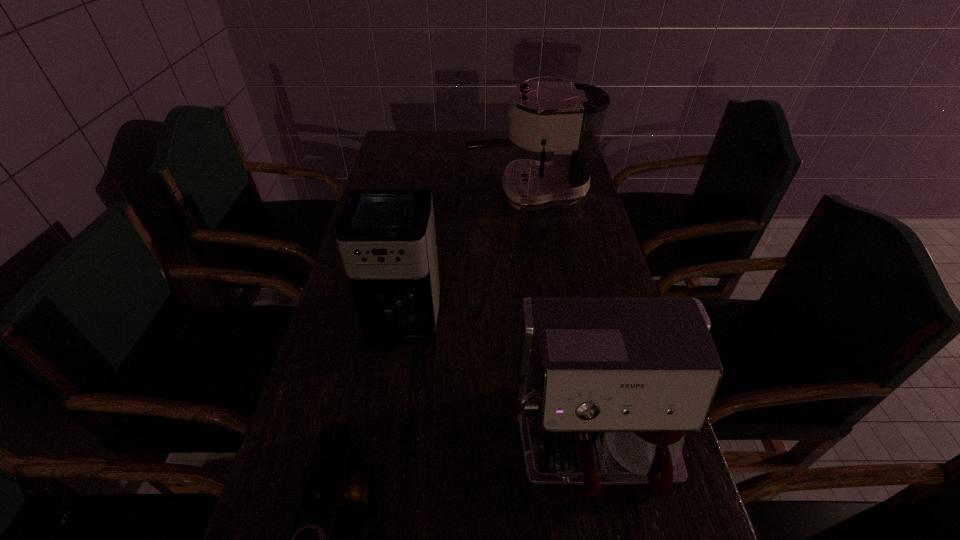
The height and width of the screenshot is (540, 960). In order to click on the farthest object in this screenshot , I will do `click(566, 119)`.

At what (x,y) coordinates should I click in order to perform the action: click on the leftmost coffee maker. Please return your answer as a coordinate pair (x, y). The height and width of the screenshot is (540, 960). Looking at the image, I should click on (386, 238).

At what (x,y) coordinates should I click in order to perform the action: click on the second nearest coffee maker. Please return your answer as a coordinate pair (x, y). Looking at the image, I should click on 386,238.

I want to click on the nearest coffee maker, so click(605, 387).

At what (x,y) coordinates should I click in order to perform the action: click on vacant space situated 0.250m on the front-facing side of the farthest object. Please return your answer as a coordinate pair (x, y). Looking at the image, I should click on (393, 193).

Image resolution: width=960 pixels, height=540 pixels. What are the coordinates of `vacant region located on the front-facing side of the farthest object` in the screenshot? It's located at (384, 193).

You are a GUI agent. You are given a task and a screenshot of the screen. Output one action in this format:
    pyautogui.click(x=<x>, y=<y>)
    Task: Click on the free location located on the front-facing side of the farthest object
    This screenshot has width=960, height=540.
    Given the screenshot: What is the action you would take?
    pyautogui.click(x=411, y=193)

Where is `vacant region located on the front panel of the leftmost coffee maker`? vacant region located on the front panel of the leftmost coffee maker is located at coordinates (388, 408).

What are the coordinates of `object at the left edge` in the screenshot? It's located at (386, 238).

Identify the location of vacant space at the far edge of the desktop. The image size is (960, 540). (492, 148).